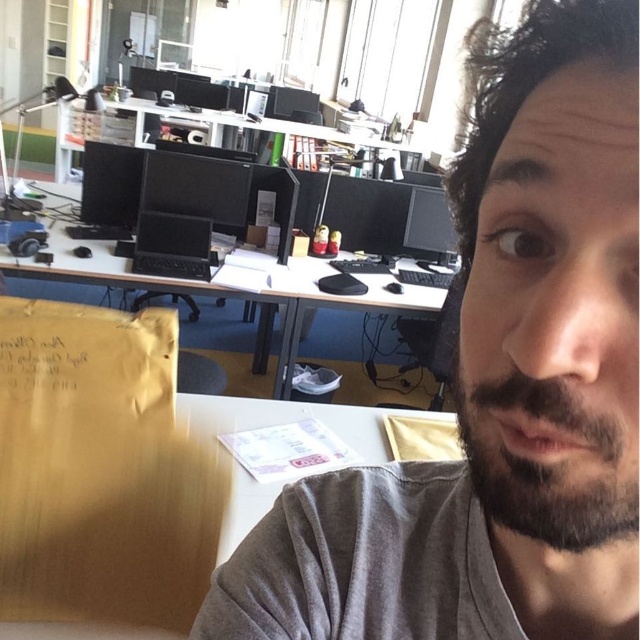
Who is lower down, dark brown fuzzy beard at lower right or matte black computer desk at center?

dark brown fuzzy beard at lower right

Describe the element at coordinates (547, 461) in the screenshot. Image resolution: width=640 pixels, height=640 pixels. I see `dark brown fuzzy beard at lower right` at that location.

Between point (522, 504) and point (230, 292), which one is positioned behind?

Point (230, 292)

Locate an element on the screen. The image size is (640, 640). dark brown fuzzy beard at lower right is located at coordinates (547, 461).

Is gray matte shirt at center below wooden at center?

Incorrect, gray matte shirt at center is not positioned below wooden at center.

Which is more to the right, gray matte shirt at center or wooden at center?

Positioned to the right is gray matte shirt at center.

Image resolution: width=640 pixels, height=640 pixels. Identify the location of gray matte shirt at center. (497, 387).

Does matte black computer desk at center appear on the right side of wooden at center?

No, matte black computer desk at center is not to the right of wooden at center.

Is matte black computer desk at center smaller than wooden at center?

Incorrect, matte black computer desk at center is not smaller in size than wooden at center.

Consider the image. Who is more forward, (376, 298) or (253, 492)?

Point (253, 492) is in front.

At what (x,y) coordinates should I click in order to perform the action: click on matte black computer desk at center. Please return your answer as a coordinate pair (x, y). The height and width of the screenshot is (640, 640). Looking at the image, I should click on (225, 285).